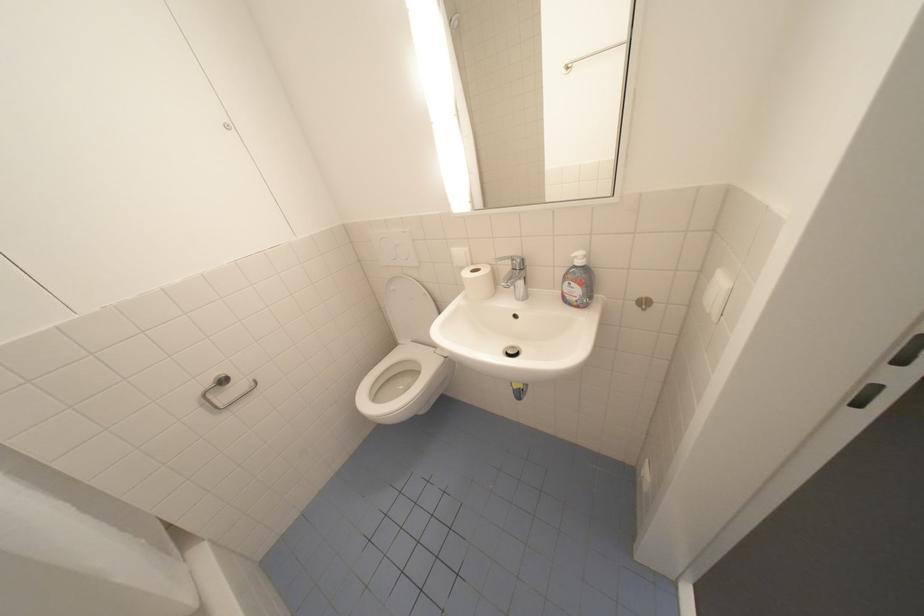
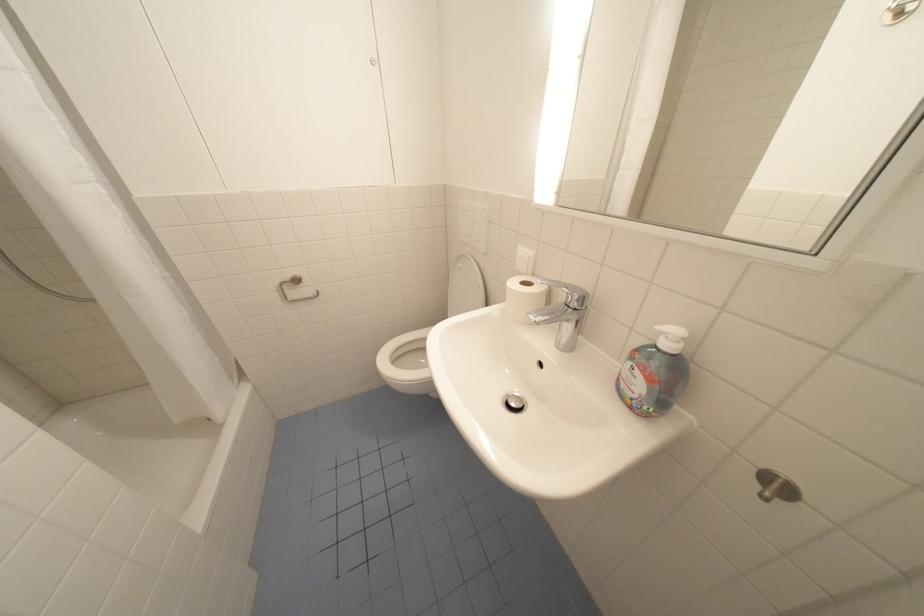
The point at (473, 276) is marked in the first image. Where is the corresponding point in the second image?

(520, 284)